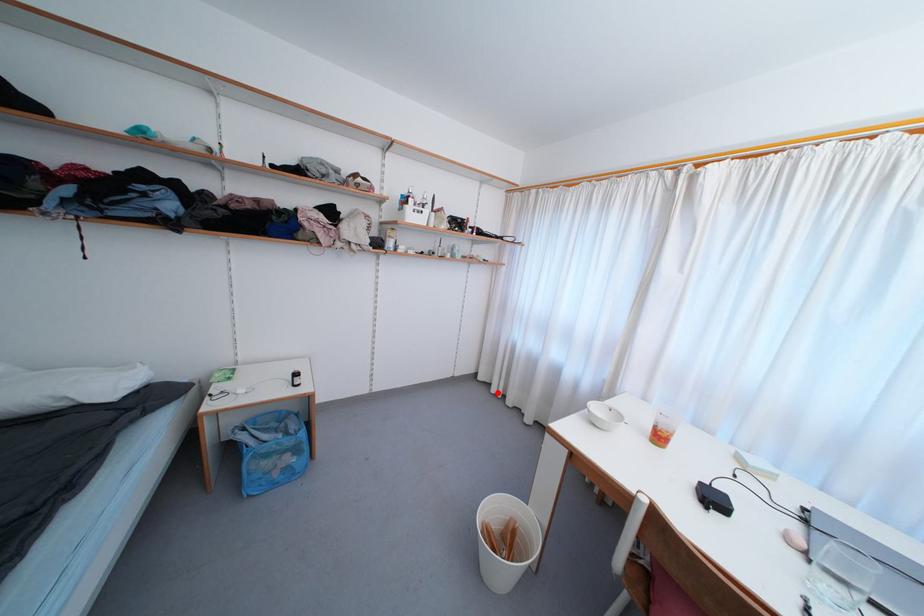
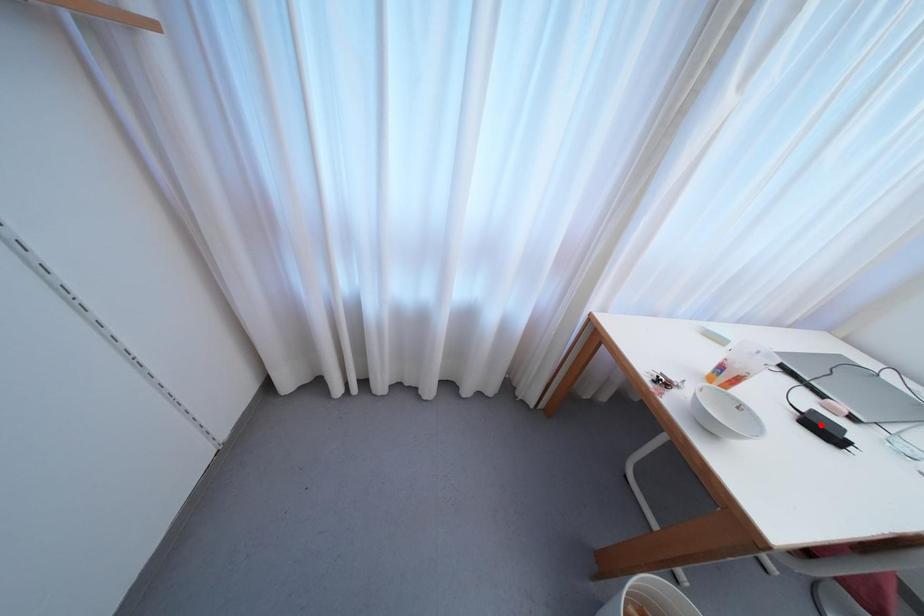
I am providing you with two images of the same scene from different viewpoints. A red point is marked on the first image and another point is marked on the second image. Are the points marked in image1 and image2 representing the same 3D position?

No